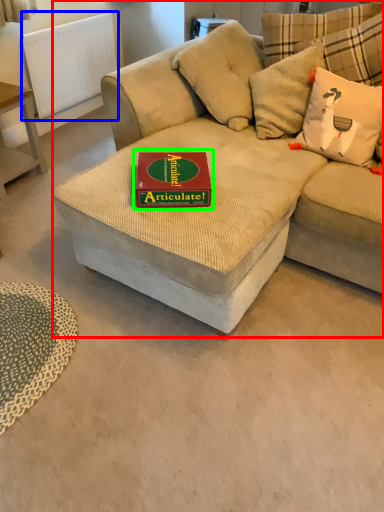
Question: Considering the real-world distances, which object is farthest from studio couch (highlighted by a red box)? radiator (highlighted by a blue box) or paperback book (highlighted by a green box)?

Choices:
 (A) radiator
 (B) paperback book

Answer: (A)